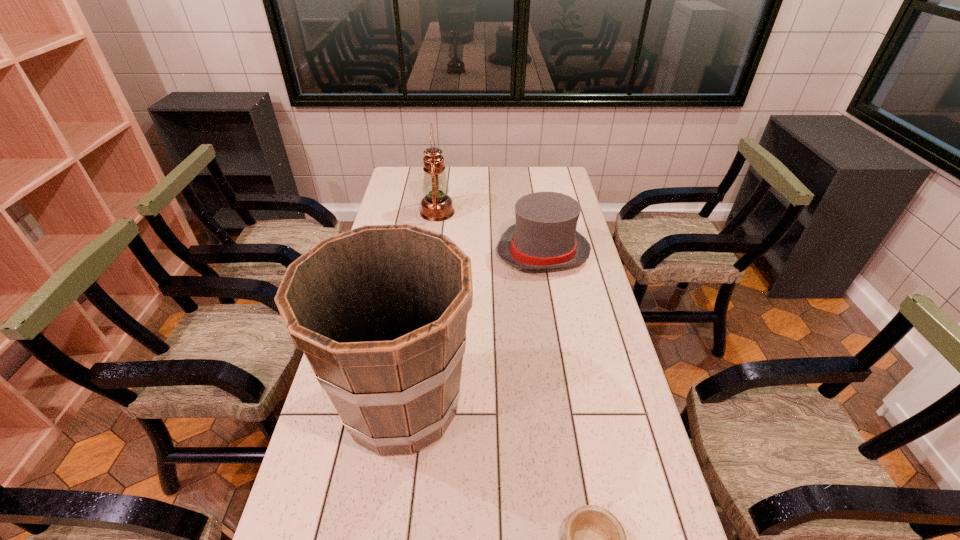
In order to click on object that is at the right edge in this screenshot , I will do `click(544, 237)`.

In the image, there is a desktop. In order to click on vacant space at the far edge in this screenshot , I will do [x=452, y=186].

This screenshot has height=540, width=960. In order to click on vacant region at the right edge in this screenshot , I will do `click(632, 403)`.

Locate an element on the screen. The width and height of the screenshot is (960, 540). empty space between the second nearest object and the third nearest object is located at coordinates (473, 328).

The height and width of the screenshot is (540, 960). Find the location of `vacant area between the bucket and the dress hat`. vacant area between the bucket and the dress hat is located at coordinates (473, 328).

Where is `empty space between the dress hat and the oil lamp`? The image size is (960, 540). empty space between the dress hat and the oil lamp is located at coordinates (491, 232).

I want to click on object that is the closest to the second nearest object, so click(x=594, y=538).

Choose which object is the nearest neighbor to the bowl. Please provide its 2D coordinates. Your answer should be formatted as a tuple, i.e. [(x, y)], where the tuple contains the x and y coordinates of a point satisfying the conditions above.

[(380, 312)]

In order to click on vacant space that satisfies the following two spatial constraints: 1. on the back side of the farthest object; 2. on the right side of the bucket in this screenshot , I will do `click(431, 212)`.